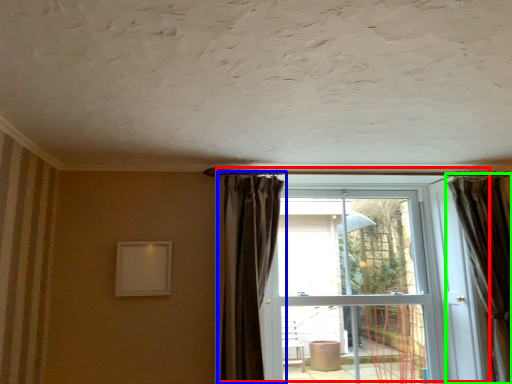
Question: Which is farther away from door (highlighted by a red box)? curtain (highlighted by a blue box) or curtain (highlighted by a green box)?

Choices:
 (A) curtain
 (B) curtain

Answer: (A)